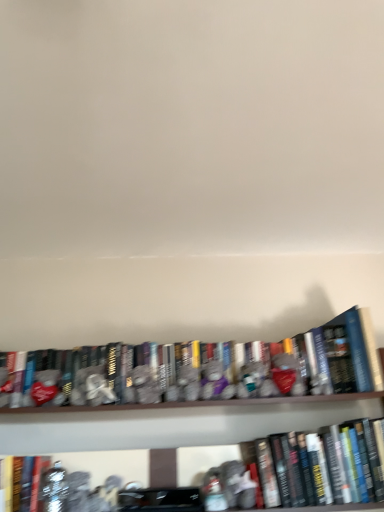
Question: From the image's perspective, does hardcover books at center, the second book from the left, appear higher than hardcover book at center, which appears as the first book when viewed from the right?

Choices:
 (A) no
 (B) yes

Answer: (B)

Question: Is hardcover books at center, which ranks as the 2th book in right-to-left order, in front of hardcover book at center, which appears as the first book when viewed from the right?

Choices:
 (A) yes
 (B) no

Answer: (B)

Question: From a real-world perspective, does hardcover books at center, which ranks as the 2th book in right-to-left order, stand above hardcover book at center, the third book when ordered from left to right?

Choices:
 (A) no
 (B) yes

Answer: (B)

Question: Would you say hardcover books at center, the second book from the left, is outside hardcover book at center, which appears as the first book when viewed from the right?

Choices:
 (A) yes
 (B) no

Answer: (A)

Question: Does hardcover books at center, the second book from the left, have a lesser height compared to hardcover book at center, which appears as the first book when viewed from the right?

Choices:
 (A) no
 (B) yes

Answer: (B)

Question: Considering the positions of hardcover books at center, the second book from the left, and hardcover book at lower left, marked as the first book in a left-to-right arrangement, in the image, is hardcover books at center, the second book from the left, taller or shorter than hardcover book at lower left, marked as the first book in a left-to-right arrangement,?

Choices:
 (A) short
 (B) tall

Answer: (A)

Question: From a real-world perspective, is hardcover books at center, the second book from the left, positioned above or below hardcover book at lower left, placed as the 3th book when sorted from right to left?

Choices:
 (A) above
 (B) below

Answer: (A)

Question: In the image, is hardcover books at center, the second book from the left, positioned in front of or behind hardcover book at lower left, placed as the 3th book when sorted from right to left?

Choices:
 (A) front
 (B) behind

Answer: (B)

Question: Is hardcover books at center, the second book from the left, spatially inside hardcover book at lower left, placed as the 3th book when sorted from right to left, or outside of it?

Choices:
 (A) inside
 (B) outside

Answer: (B)

Question: From the image's perspective, is hardcover book at center, which appears as the first book when viewed from the right, above or below hardcover book at lower left, marked as the first book in a left-to-right arrangement?

Choices:
 (A) below
 (B) above

Answer: (B)

Question: Considering the positions of point (354, 474) and point (49, 461), is point (354, 474) closer or farther from the camera than point (49, 461)?

Choices:
 (A) farther
 (B) closer

Answer: (B)

Question: From their relative heights in the image, would you say hardcover book at center, the third book when ordered from left to right, is taller or shorter than hardcover book at lower left, placed as the 3th book when sorted from right to left?

Choices:
 (A) short
 (B) tall

Answer: (B)

Question: Considering the positions of hardcover book at center, which appears as the first book when viewed from the right, and hardcover book at lower left, placed as the 3th book when sorted from right to left, in the image, is hardcover book at center, which appears as the first book when viewed from the right, wider or thinner than hardcover book at lower left, placed as the 3th book when sorted from right to left,?

Choices:
 (A) thin
 (B) wide

Answer: (B)

Question: From the image's perspective, is hardcover book at lower left, placed as the 3th book when sorted from right to left, located above or below hardcover books at center, the second book from the left?

Choices:
 (A) above
 (B) below

Answer: (B)

Question: Relative to hardcover books at center, which ranks as the 2th book in right-to-left order, is hardcover book at lower left, placed as the 3th book when sorted from right to left, in front or behind?

Choices:
 (A) behind
 (B) front

Answer: (B)